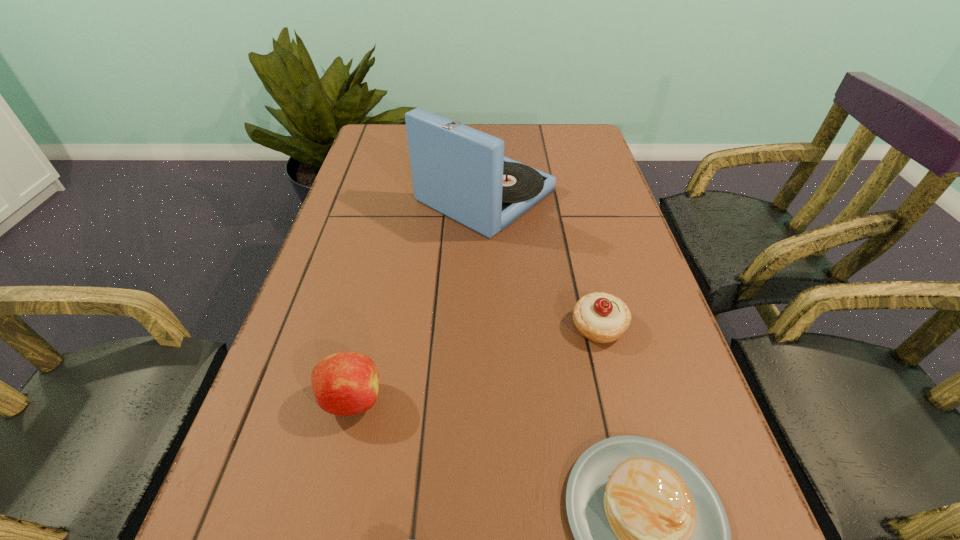
The image size is (960, 540). Find the location of `the tallest object`. the tallest object is located at coordinates (460, 172).

Locate an element on the screen. Image resolution: width=960 pixels, height=540 pixels. phonograph record is located at coordinates (460, 172).

Find the location of a particular element. apple is located at coordinates (346, 383).

Where is `the second tallest object`? This screenshot has height=540, width=960. the second tallest object is located at coordinates (346, 383).

Locate an element on the screen. pastry is located at coordinates (600, 317).

You are a GUI agent. You are given a task and a screenshot of the screen. Output one action in this format:
    pyautogui.click(x=<x>, y=<y>)
    Task: Click on the second farthest object
    
    Given the screenshot: What is the action you would take?
    pyautogui.click(x=600, y=317)

At what (x,y) coordinates should I click in order to perform the action: click on vacant space situated 0.100m on the left of the phonograph record. Please return your answer as a coordinate pair (x, y). Looking at the image, I should click on (378, 196).

You are a GUI agent. You are given a task and a screenshot of the screen. Output one action in this format:
    pyautogui.click(x=<x>, y=<y>)
    Task: Click on the free space located 0.320m on the back of the second tallest object
    This screenshot has width=960, height=540.
    Given the screenshot: What is the action you would take?
    pyautogui.click(x=385, y=255)

Find the location of a particular element. The width and height of the screenshot is (960, 540). free spot located on the front of the second shortest object is located at coordinates (613, 387).

Where is `object positioned at the left edge`? This screenshot has width=960, height=540. object positioned at the left edge is located at coordinates (346, 383).